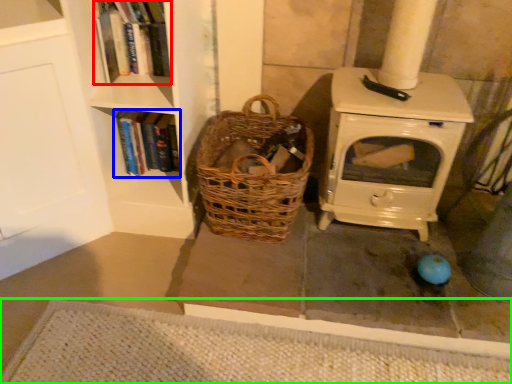
Question: Based on their relative distances, which object is nearer to book (highlighted by a red box)? Choose from book (highlighted by a blue box) and doormat (highlighted by a green box).

Choices:
 (A) book
 (B) doormat

Answer: (A)